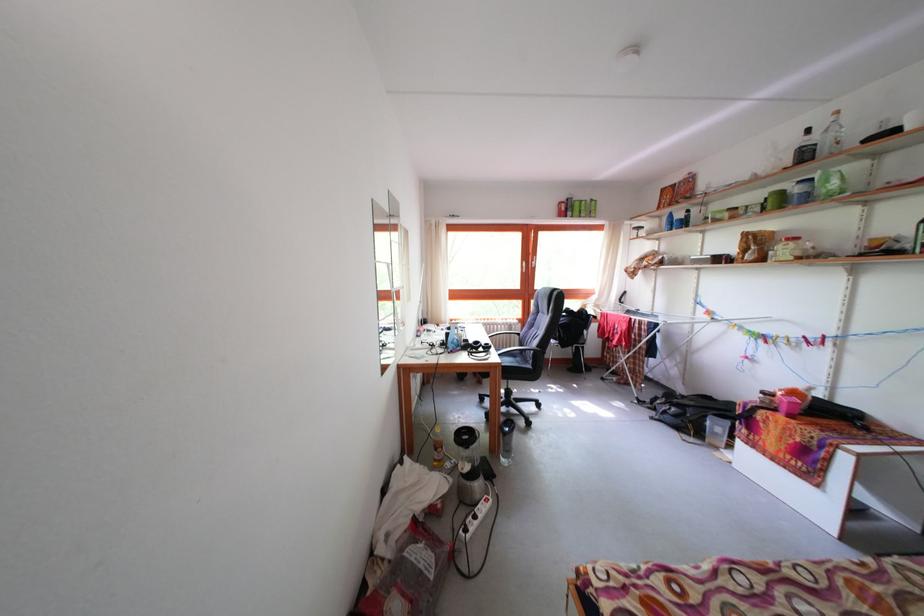
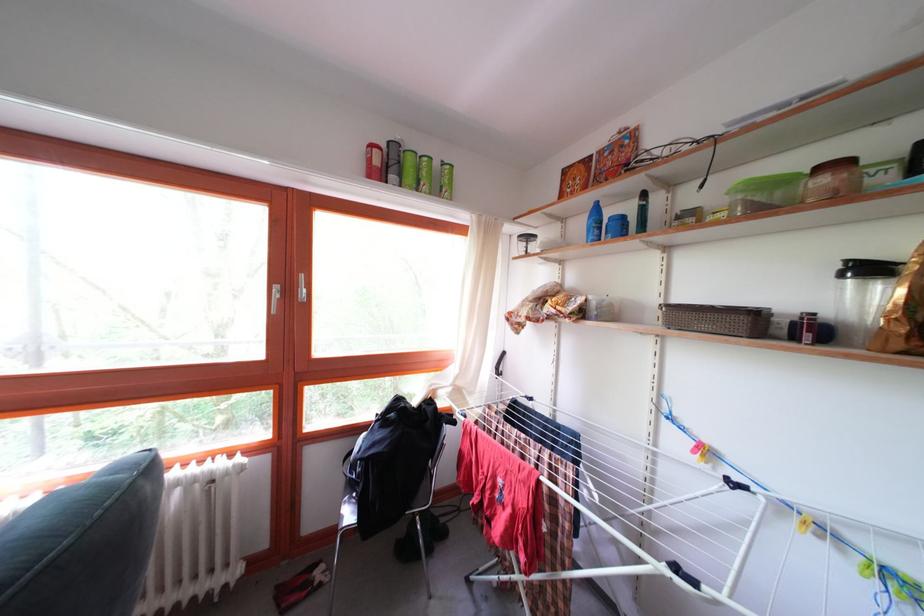
Find the pixel in the second image that matches the point at 675,217 in the first image.

(598, 204)